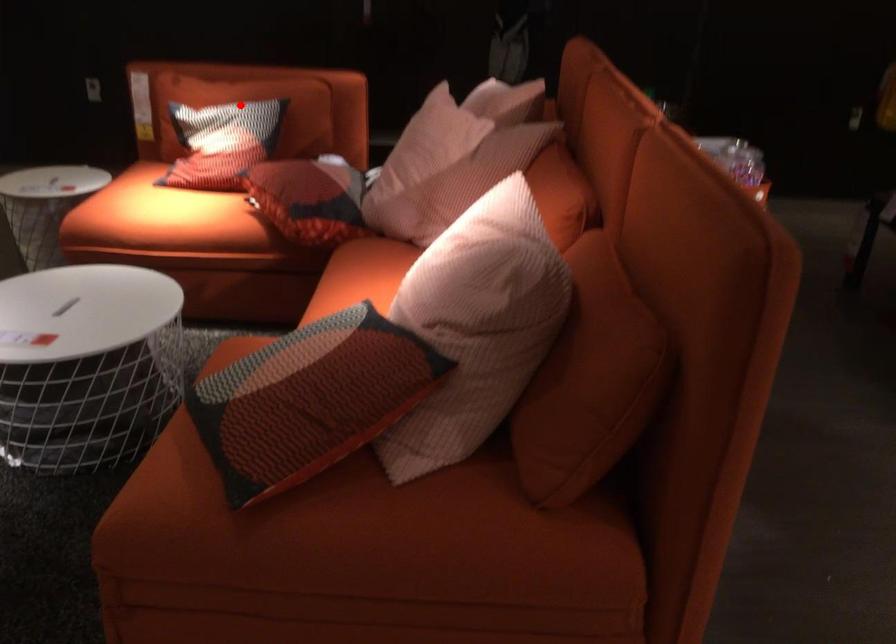
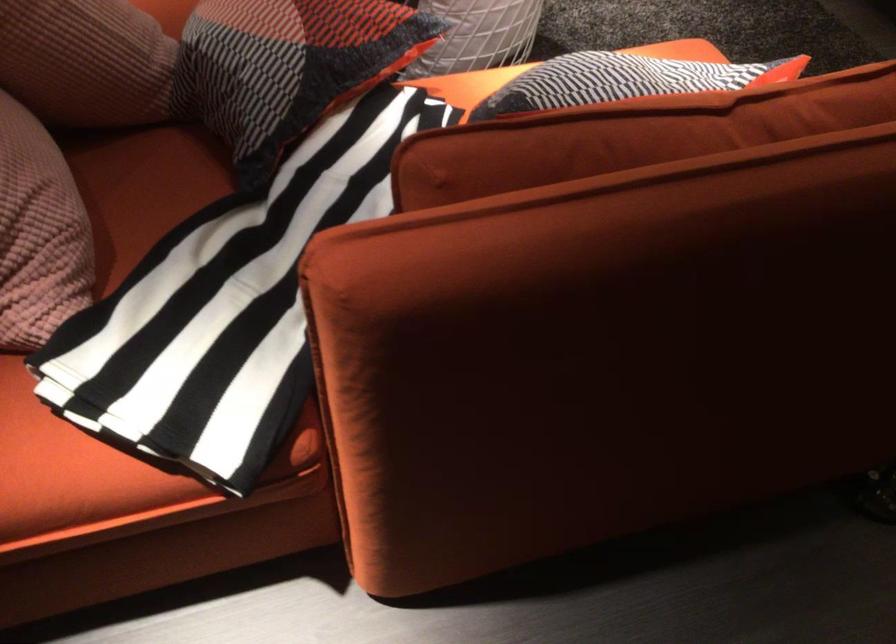
Question: I am providing you with two images of the same scene from different viewpoints. Given a red point in image1, look at the same physical point in image2. Is it:

Choices:
 (A) Closer to the viewpoint
 (B) Farther from the viewpoint

Answer: (A)